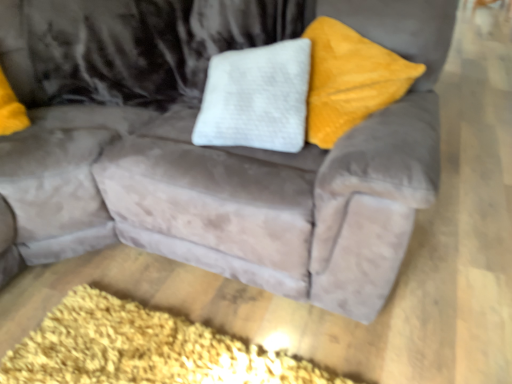
Find the location of a particular element. vacant space underneath yellow fluffy rug at lower left (from a real-world perspective) is located at coordinates (126, 348).